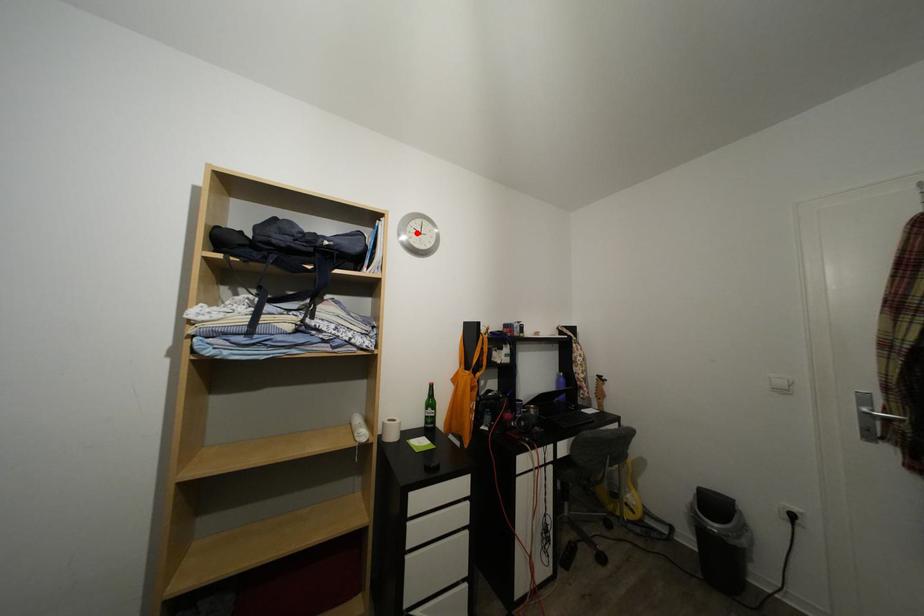
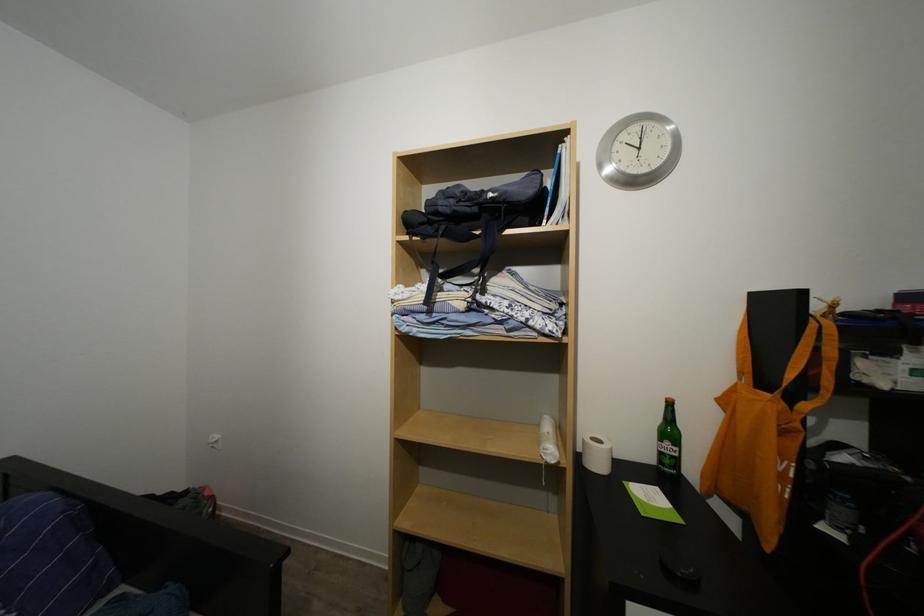
Locate, in the second image, the point that corresponds to the highlighted location in the first image.

(625, 151)